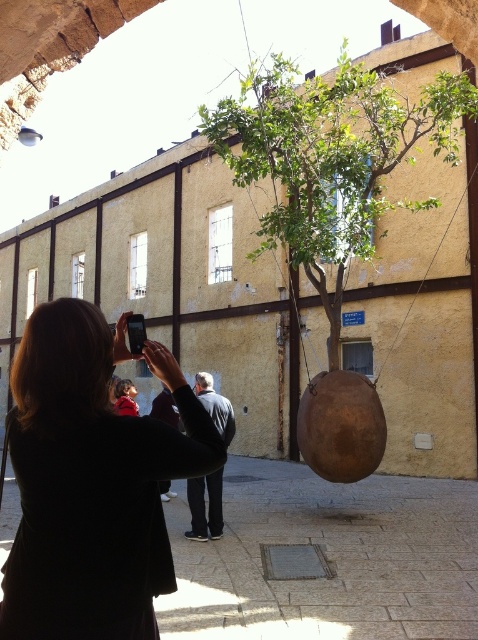
Is point (343, 262) more distant than point (196, 506)?

Yes, point (343, 262) is behind point (196, 506).

Between green leafy tree at center and dark gray jacket at center, which one is positioned higher?

green leafy tree at center

Is point (352, 154) positioned after point (206, 481)?

Yes.

I want to click on green leafy tree at center, so click(x=332, y=157).

Is matte black jacket at left to the left of dark gray jacket at center from the viewer's perspective?

Incorrect, matte black jacket at left is not on the left side of dark gray jacket at center.

Locate an element on the screen. matte black jacket at left is located at coordinates (91, 481).

Does point (54, 360) lie behind point (411, 202)?

No, it is not.

Is point (152, 440) closer to camera compared to point (259, 109)?

Yes.

Is point (0, 628) more distant than point (375, 141)?

No, (0, 628) is in front of (375, 141).

Where is `matte black jacket at left`? matte black jacket at left is located at coordinates (91, 481).